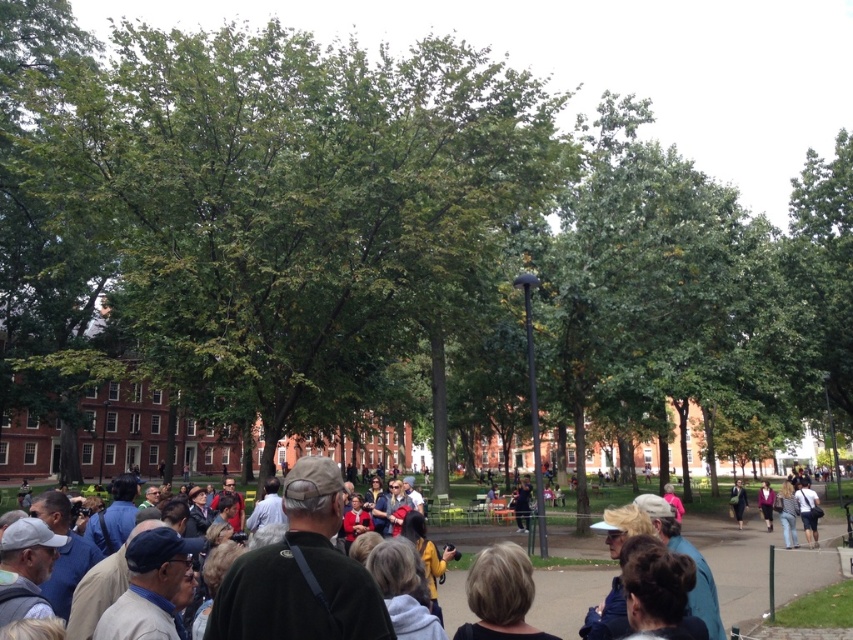
Question: Can you confirm if dark blue jeans at center is positioned below dark blue jacket at center?

Choices:
 (A) no
 (B) yes

Answer: (A)

Question: Estimate the real-world distances between objects in this image. Which object is farther from the blonde hair at center?

Choices:
 (A) dark blue jeans at center
 (B) dark purple sweater at center
 (C) dark blue jacket at center

Answer: (C)

Question: Can you confirm if blonde hair at center is thinner than dark blue jeans at center?

Choices:
 (A) no
 (B) yes

Answer: (B)

Question: Does jeans at right have a larger size compared to dark purple sweater at center?

Choices:
 (A) yes
 (B) no

Answer: (A)

Question: Among these points, which one is nearest to the camera?

Choices:
 (A) (529, 592)
 (B) (732, 484)

Answer: (A)

Question: Based on their relative distances, which object is nearer to the blonde hair at center?

Choices:
 (A) dark purple sweater at center
 (B) jeans at right

Answer: (B)